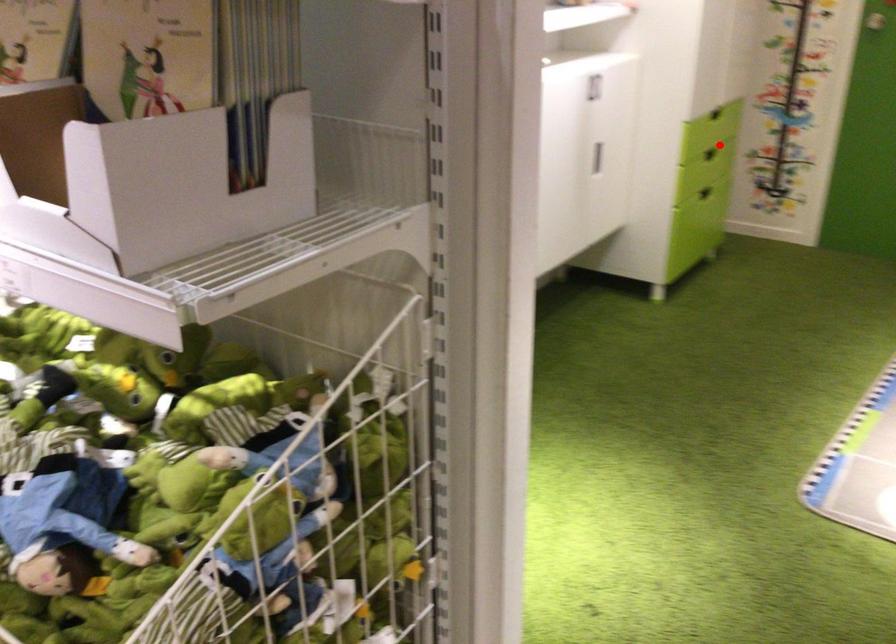
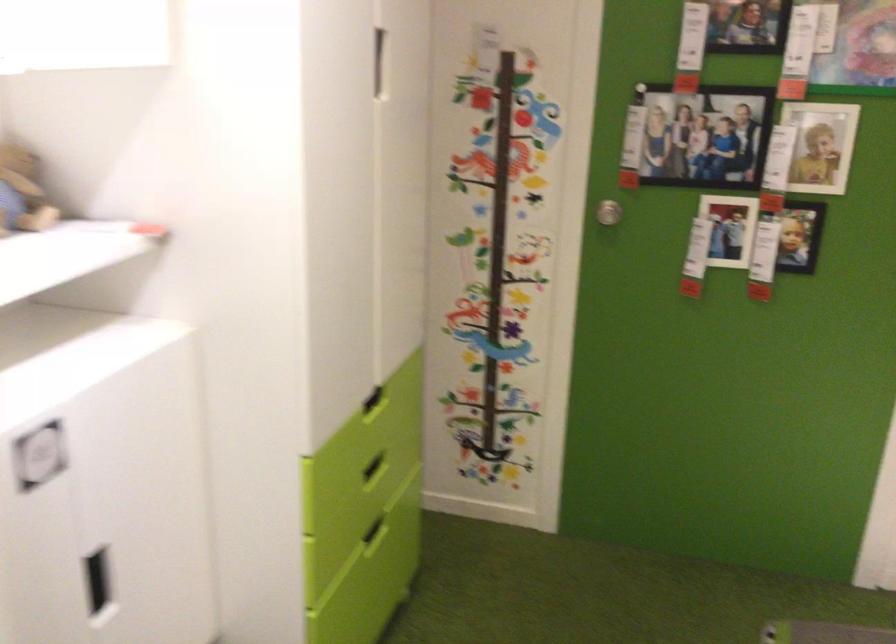
Find the pixel in the second image that matches the highlighted location in the first image.

(374, 468)